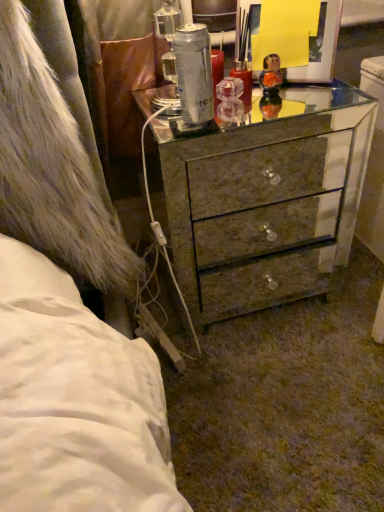
You are a GUI agent. You are given a task and a screenshot of the screen. Output one action in this format:
    pyautogui.click(x=<x>, y=<y>)
    Task: Click on the free point below metallic mirrored chest of drawers at center (from a real-world perspective)
    The width and height of the screenshot is (384, 512).
    Given the screenshot: What is the action you would take?
    pyautogui.click(x=243, y=297)